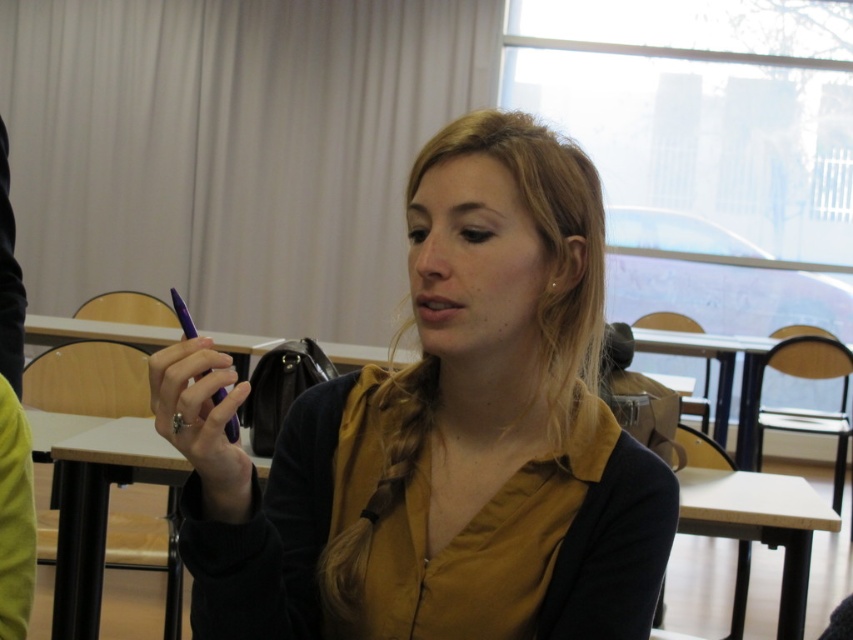
Question: From the image, what is the correct spatial relationship of matte purple pen at center in relation to purple glossy pen at center?

Choices:
 (A) left
 (B) right

Answer: (B)

Question: Can you confirm if matte purple pen at center is thinner than purple glossy pen at center?

Choices:
 (A) yes
 (B) no

Answer: (B)

Question: Among these points, which one is nearest to the camera?

Choices:
 (A) (347, 436)
 (B) (238, 435)

Answer: (B)

Question: Is matte purple pen at center thinner than purple glossy pen at center?

Choices:
 (A) yes
 (B) no

Answer: (B)